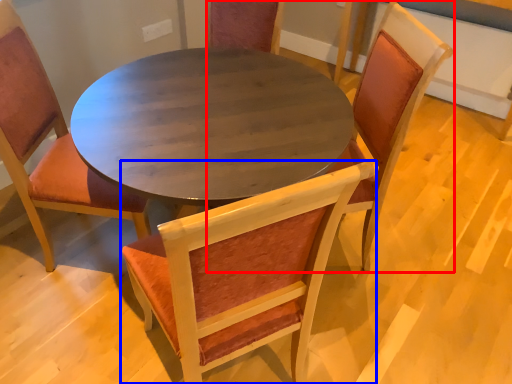
Question: Which of the following is the farthest to the observer, chair (highlighted by a red box) or chair (highlighted by a blue box)?

Choices:
 (A) chair
 (B) chair

Answer: (A)